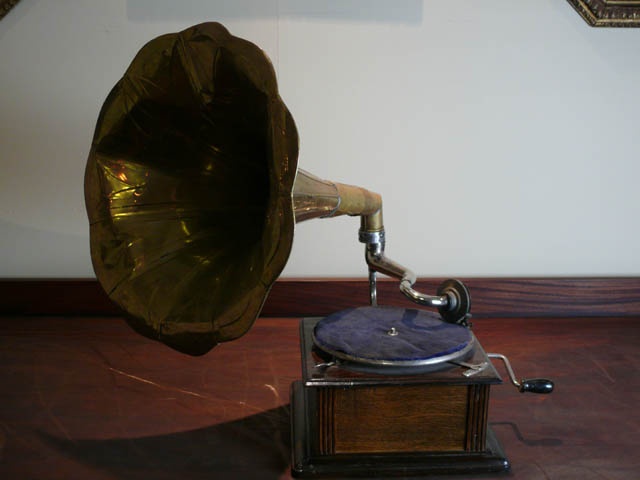
Where is `wall trim`? This screenshot has height=480, width=640. wall trim is located at coordinates (580, 299), (336, 297), (81, 294).